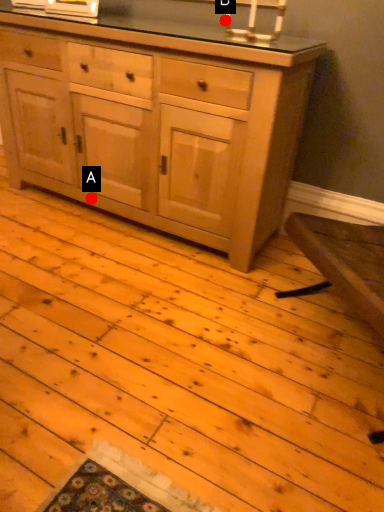
Question: Two points are circled on the image, labeled by A and B beside each circle. Which point appears closest to the camera in this image?

Choices:
 (A) A is closer
 (B) B is closer

Answer: (B)